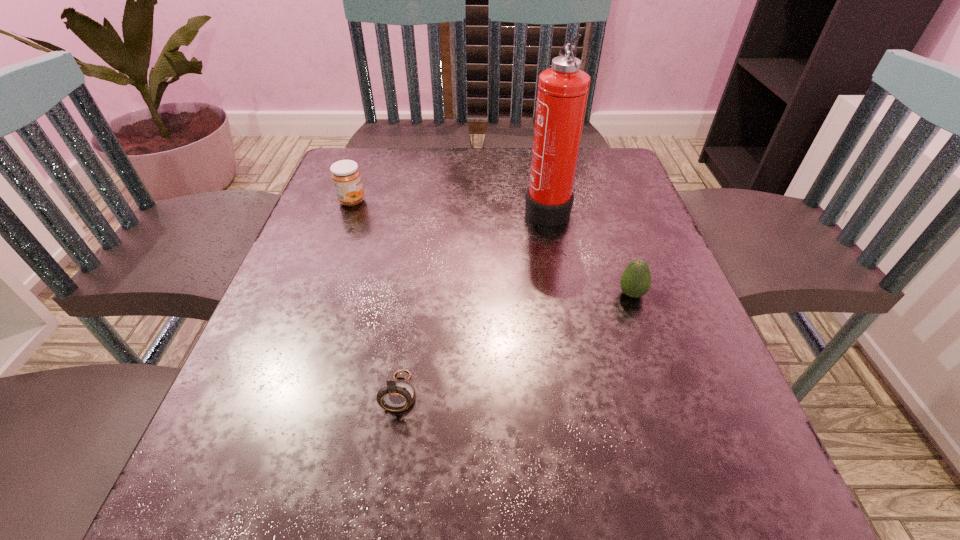
The height and width of the screenshot is (540, 960). In order to click on vacant space located on the front label of the leftmost object in this screenshot , I will do `click(399, 201)`.

I want to click on vacant area situated 0.070m on the right of the second nearest object, so click(x=683, y=294).

At what (x,y) coordinates should I click in order to perform the action: click on blank area located 0.080m on the face of the compass. Please return your answer as a coordinate pair (x, y). Looking at the image, I should click on (389, 471).

What are the coordinates of `fire extinguisher located in the far edge section of the desktop` in the screenshot? It's located at (x=563, y=89).

The width and height of the screenshot is (960, 540). Find the location of `jam that is at the far edge`. jam that is at the far edge is located at coordinates (346, 177).

At what (x,y) coordinates should I click in order to perform the action: click on object situated at the left edge. Please return your answer as a coordinate pair (x, y). The width and height of the screenshot is (960, 540). Looking at the image, I should click on (346, 177).

The image size is (960, 540). I want to click on object positioned at the right edge, so click(x=635, y=282).

I want to click on object at the far left corner, so click(346, 177).

Identify the location of free space at the far edge of the desktop. This screenshot has width=960, height=540. (433, 194).

The width and height of the screenshot is (960, 540). In the image, there is a desktop. What are the coordinates of `vacant space at the near edge` in the screenshot? It's located at (447, 532).